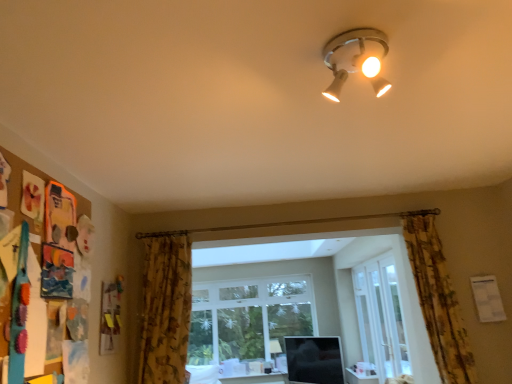
Question: From the image's perspective, would you say matte white ceiling light at upper center, which ranks as the 1th lamp in top-to-bottom order, is positioned over white glossy screen door at center?

Choices:
 (A) yes
 (B) no

Answer: (A)

Question: Is matte white ceiling light at upper center, the first lamp viewed from the front, thinner than white glossy screen door at center?

Choices:
 (A) yes
 (B) no

Answer: (B)

Question: Is matte white ceiling light at upper center, which ranks as the 1th lamp in top-to-bottom order, bigger than white glossy screen door at center?

Choices:
 (A) yes
 (B) no

Answer: (B)

Question: From a real-world perspective, is matte white ceiling light at upper center, which appears as the 2th lamp when viewed from the back, physically above white glossy screen door at center?

Choices:
 (A) yes
 (B) no

Answer: (A)

Question: Is white glossy screen door at center located within matte white ceiling light at upper center, the first lamp viewed from the front?

Choices:
 (A) no
 (B) yes

Answer: (A)

Question: Could you tell me if matte white ceiling light at upper center, which appears as the 2th lamp when viewed from the back, is turned towards white glossy screen door at center?

Choices:
 (A) no
 (B) yes

Answer: (A)

Question: Does clear glass door at center have a greater width compared to matte white lamp at lower center, the first lamp when ordered from bottom to top?

Choices:
 (A) no
 (B) yes

Answer: (A)

Question: Is clear glass door at center surrounding matte white lamp at lower center, the second lamp viewed from the top?

Choices:
 (A) no
 (B) yes

Answer: (A)

Question: Is clear glass door at center looking in the opposite direction of matte white lamp at lower center, the second lamp viewed from the top?

Choices:
 (A) yes
 (B) no

Answer: (B)

Question: Does clear glass door at center appear on the left side of matte white lamp at lower center, the second lamp viewed from the top?

Choices:
 (A) no
 (B) yes

Answer: (A)

Question: Could you tell me if clear glass door at center is facing matte white lamp at lower center, the first lamp when ordered from back to front?

Choices:
 (A) no
 (B) yes

Answer: (A)

Question: Considering the relative positions of clear glass door at center and matte white lamp at lower center, the first lamp when ordered from back to front, in the image provided, is clear glass door at center to the right of matte white lamp at lower center, the first lamp when ordered from back to front, from the viewer's perspective?

Choices:
 (A) no
 (B) yes

Answer: (B)

Question: Can you confirm if matte white table at lower center is positioned to the right of floral fabric curtain at right, which is the 2th curtain in left-to-right order?

Choices:
 (A) no
 (B) yes

Answer: (A)